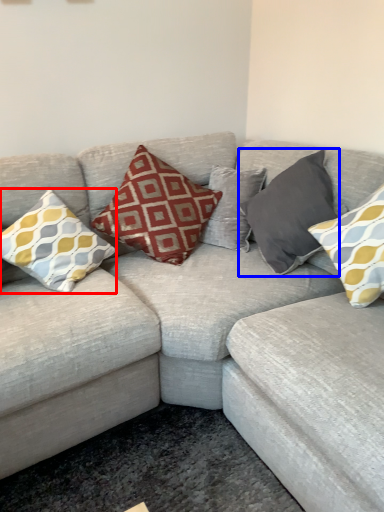
Question: Among these objects, which one is farthest to the camera, pillow (highlighted by a red box) or pillow (highlighted by a blue box)?

Choices:
 (A) pillow
 (B) pillow

Answer: (B)